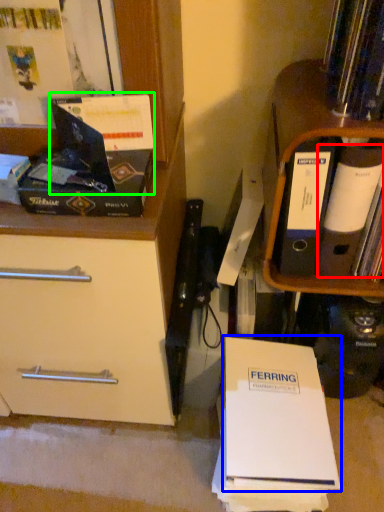
Question: Which is nearer to the paperback book (highlighted by a red box)? paperback book (highlighted by a blue box) or paperback book (highlighted by a green box).

Choices:
 (A) paperback book
 (B) paperback book

Answer: (A)